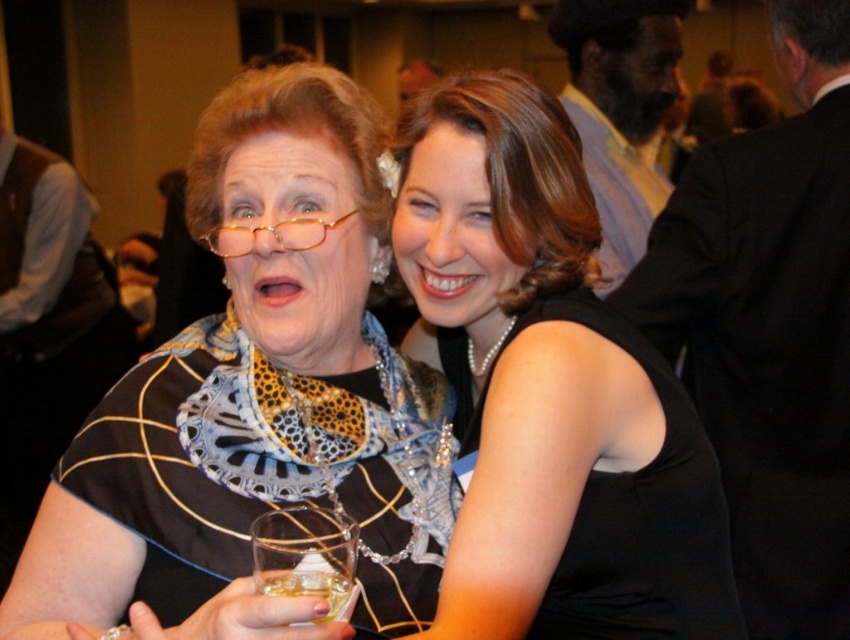
You are at a party and need to pour a drink into the larger glass. Which one should you choose between the clear glass at center and the translucent glass at lower center?

The clear glass at center is bigger than the translucent glass at lower center, so you should choose the clear glass at center to pour the drink.

You are a bartender at a party and need to choose a glass for a customer who prefers wider glasses. Which one between the clear glass at center and the translucent glass at lower center should you pick?

The clear glass at center is wider than the translucent glass at lower center, so you should pick the clear glass at center.